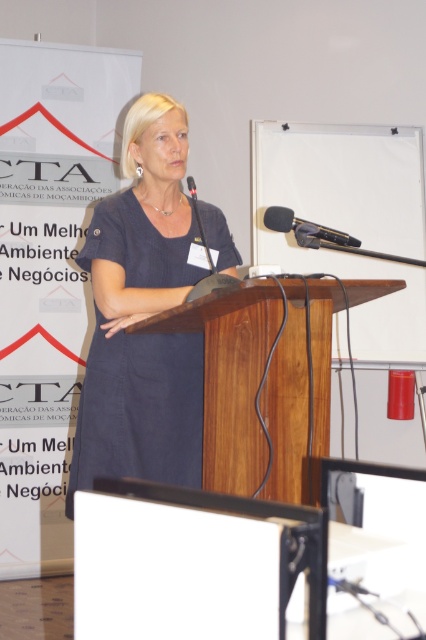
You are an event organizer checking the setup for a presentation. You notice the dark blue dress at center and the black plastic microphone at center. Which object is positioned closer to the front of the stage?

The dark blue dress at center is closer to the viewer than the black plastic microphone at center, so the dark blue dress at center is positioned closer to the front of the stage.